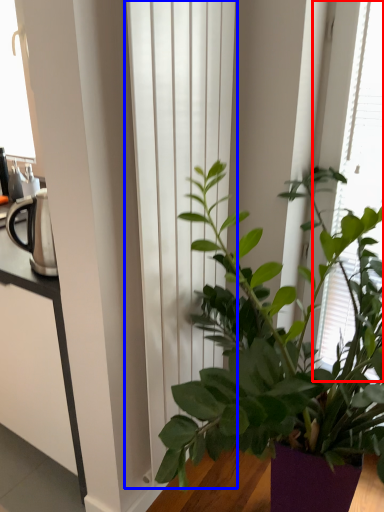
Question: Which of the following is the closest to the observer, bay window (highlighted by a red box) or curtain (highlighted by a blue box)?

Choices:
 (A) bay window
 (B) curtain

Answer: (B)